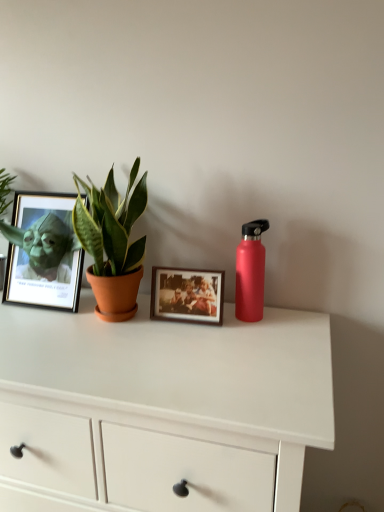
Locate an element on the screen. Image resolution: width=384 pixels, height=512 pixels. vacant space that is to the left of matte red water bottle at right is located at coordinates (179, 329).